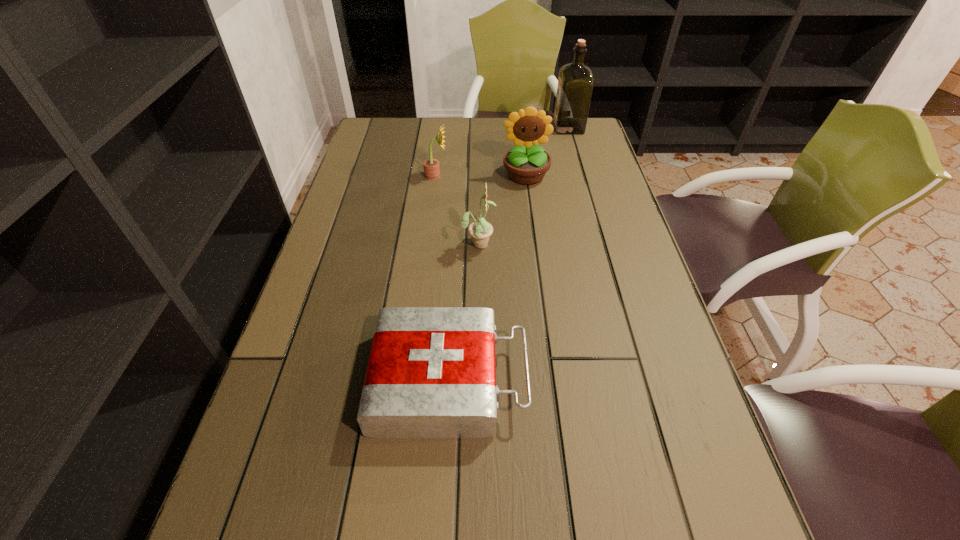
At what (x,y) coordinates should I click in order to perform the action: click on the tallest object. Please return your answer as a coordinate pair (x, y). This screenshot has width=960, height=540. Looking at the image, I should click on (575, 83).

This screenshot has height=540, width=960. In order to click on liquor in this screenshot , I will do pos(575,83).

Locate an element on the screen. Image resolution: width=960 pixels, height=540 pixels. the tallest sunflower is located at coordinates (527, 163).

I want to click on the fourth shortest object, so click(527, 163).

Where is `the fourth farthest object`? This screenshot has height=540, width=960. the fourth farthest object is located at coordinates (480, 230).

The width and height of the screenshot is (960, 540). Identify the location of the nearest sunflower. (480, 230).

This screenshot has height=540, width=960. In order to click on the leftmost sunflower in this screenshot , I will do `click(431, 166)`.

You are a GUI agent. You are given a task and a screenshot of the screen. Output one action in this format:
    pyautogui.click(x=<x>, y=<y>)
    Task: Click on the shortest object
    The height and width of the screenshot is (540, 960).
    Given the screenshot: What is the action you would take?
    pyautogui.click(x=431, y=373)

Identify the location of the first-aid kit. (431, 373).

Where is `free spot located 0.160m on the label of the liquor`? free spot located 0.160m on the label of the liquor is located at coordinates (509, 127).